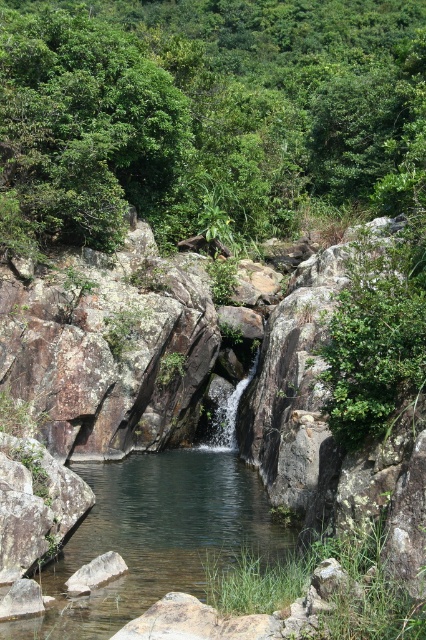
Question: Does green leafy tree at upper center have a larger size compared to clear water stream at center?

Choices:
 (A) no
 (B) yes

Answer: (B)

Question: Can you confirm if green leafy tree at upper center is positioned to the right of clear water stream at center?

Choices:
 (A) no
 (B) yes

Answer: (B)

Question: Which point appears farthest from the camera in this image?

Choices:
 (A) (40, 97)
 (B) (109, 490)

Answer: (A)

Question: Can you confirm if green leafy tree at upper center is thinner than clear water stream at center?

Choices:
 (A) yes
 (B) no

Answer: (B)

Question: Among these points, which one is farthest from the camera?

Choices:
 (A) (226, 484)
 (B) (89, 120)

Answer: (B)